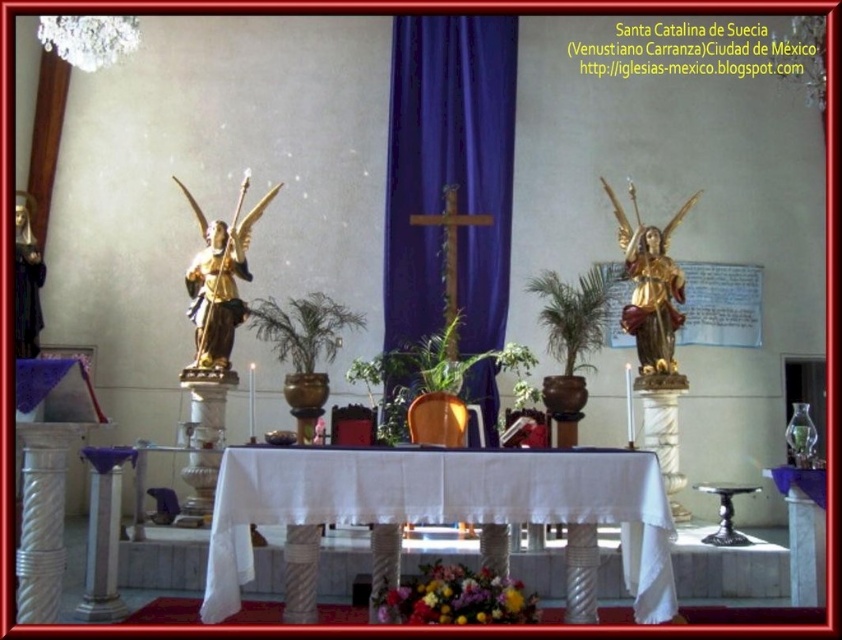
Question: Which object is farther from the camera taking this photo?

Choices:
 (A) white cloth-covered table at center
 (B) gold polished statue at center
 (C) floral bouquet at lower center

Answer: (B)

Question: Which point is closer to the camera?

Choices:
 (A) gold polished statue at left
 (B) white cloth-covered table at center
 (C) floral bouquet at lower center
 (D) gold polished statue at center

Answer: (C)

Question: Among these points, which one is nearest to the camera?

Choices:
 (A) (248, 220)
 (B) (646, 326)

Answer: (B)

Question: Does white cloth-covered table at center come in front of gold polished statue at left?

Choices:
 (A) no
 (B) yes

Answer: (B)

Question: Where is white cloth-covered table at center located in relation to floral bouquet at lower center in the image?

Choices:
 (A) below
 (B) above

Answer: (B)

Question: Does white cloth-covered table at center have a lesser width compared to floral bouquet at lower center?

Choices:
 (A) yes
 (B) no

Answer: (B)